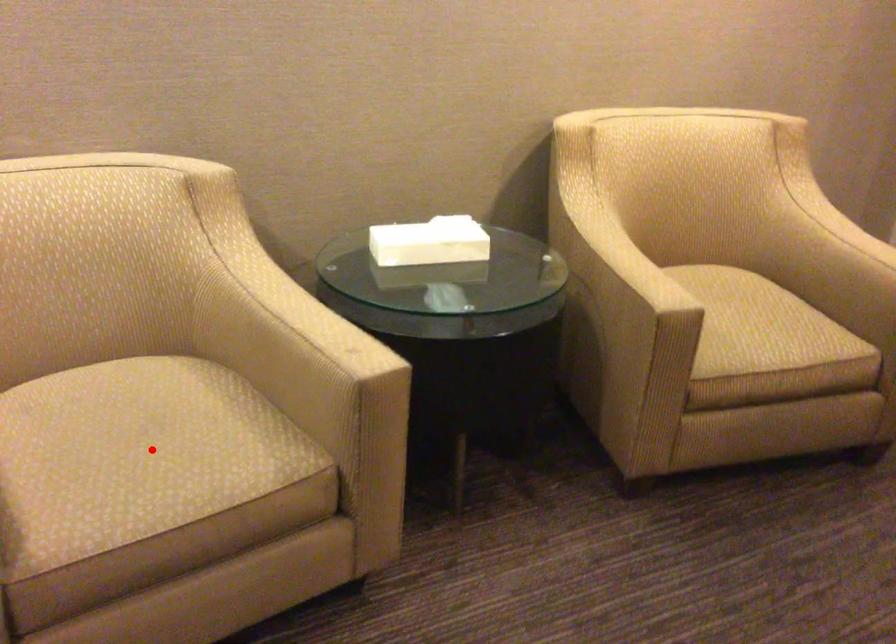
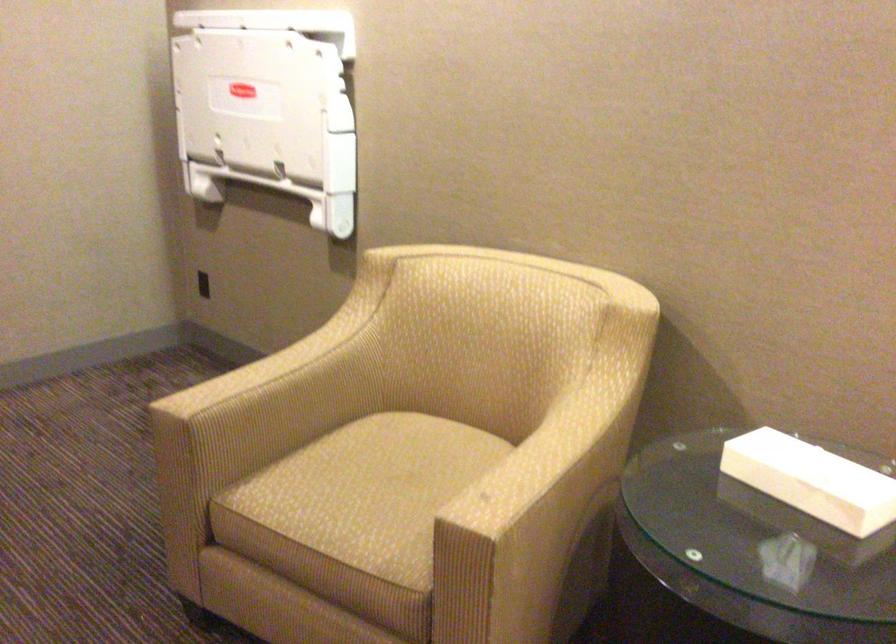
Find the pixel in the second image that matches the highlighted location in the first image.

(371, 491)